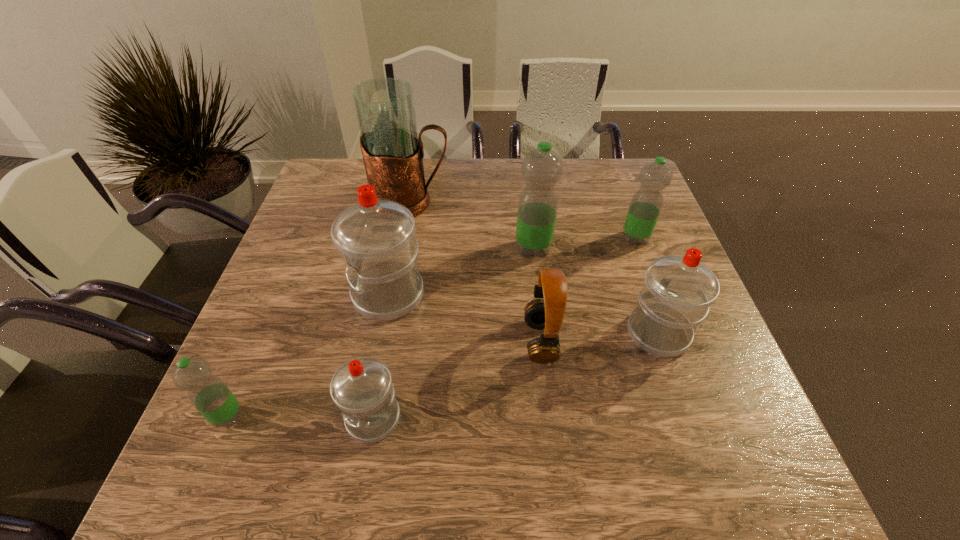
Locate an element on the screen. The height and width of the screenshot is (540, 960). gray pitcher is located at coordinates (393, 154).

The height and width of the screenshot is (540, 960). In order to click on the farthest object in this screenshot , I will do `click(393, 154)`.

Image resolution: width=960 pixels, height=540 pixels. What are the coordinates of `the second green water bottle from right to left` in the screenshot? It's located at coord(542,168).

I want to click on the biggest green water bottle, so (542, 168).

At what (x,y) coordinates should I click in order to perform the action: click on the biggest white water bottle. Please return your answer as a coordinate pair (x, y). Looking at the image, I should click on (375, 237).

Where is `the rightmost green water bottle`? This screenshot has height=540, width=960. the rightmost green water bottle is located at coordinates (647, 202).

This screenshot has width=960, height=540. In order to click on the second smallest white water bottle in this screenshot , I will do `click(678, 290)`.

Locate an element on the screen. brown headset is located at coordinates (548, 313).

Where is `the smallest white water bottle`? the smallest white water bottle is located at coordinates (362, 389).

Where is `the nearest green water bottle`? This screenshot has width=960, height=540. the nearest green water bottle is located at coordinates (208, 393).